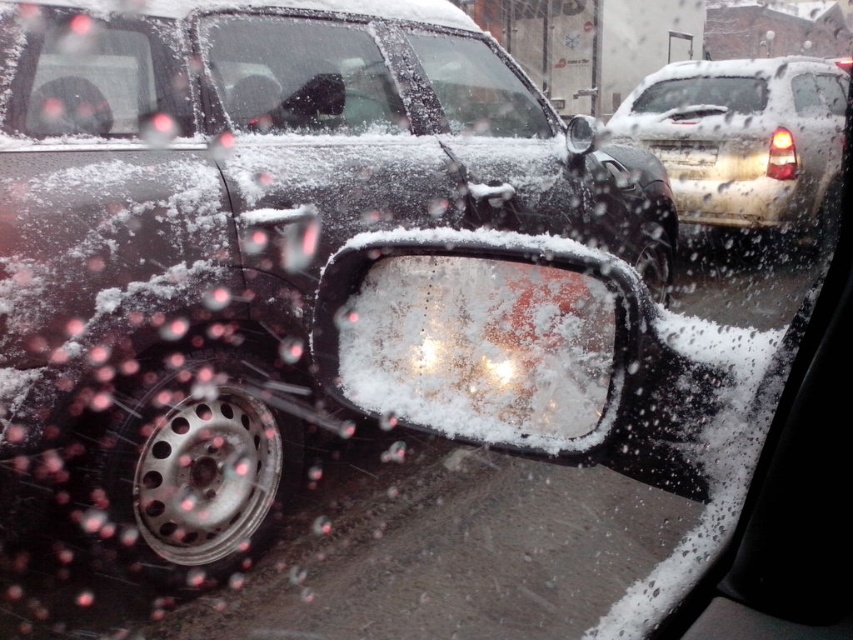
Who is more distant from viewer, (401, 120) or (618, 305)?

Point (401, 120)

Is sleek black car at center positioned before frosted glass side mirror at center?

No, sleek black car at center is behind frosted glass side mirror at center.

Between point (120, 253) and point (340, 388), which one is positioned in front?

Point (340, 388) is in front.

Locate an element on the screen. This screenshot has height=640, width=853. sleek black car at center is located at coordinates (231, 237).

Which is behind, point (569, 429) or point (824, 96)?

The point (824, 96) is more distant.

Does frosted glass side mirror at center come in front of clear glass window at upper right?

That is True.

Which is behind, point (390, 273) or point (811, 83)?

The point (811, 83) is more distant.

Where is `frosted glass side mirror at center`? The width and height of the screenshot is (853, 640). frosted glass side mirror at center is located at coordinates (483, 337).

Who is more distant from viewer, (x=677, y=83) or (x=804, y=90)?

Point (x=677, y=83)

Describe the element at coordinates (703, 93) in the screenshot. I see `clear glass car window at upper center` at that location.

Which is behind, point (660, 97) or point (820, 81)?

Point (660, 97)

The width and height of the screenshot is (853, 640). I want to click on clear glass car window at upper center, so click(x=703, y=93).